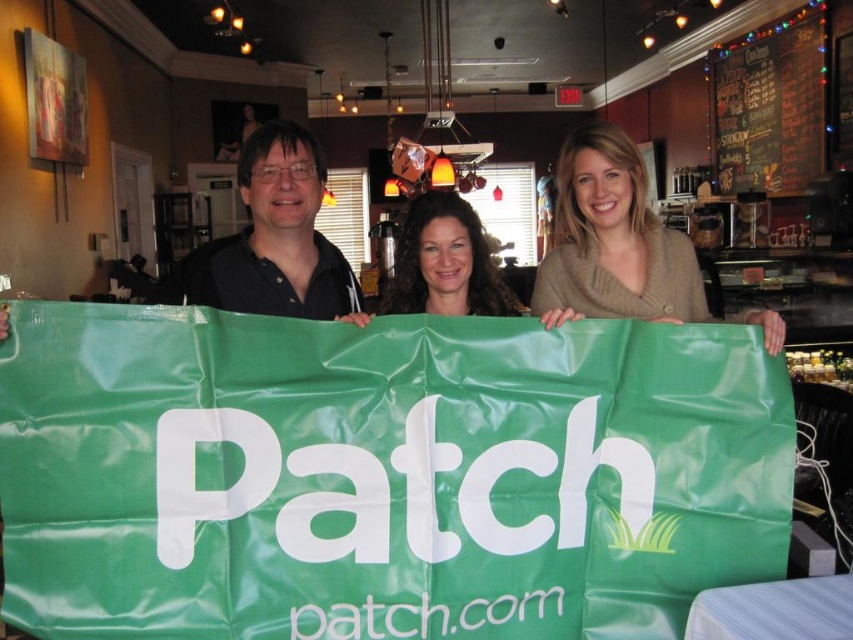
Looking at this image, you are a photographer setting up a shot of the scene. You need to ensure that the matte black shirt at center and the black chalkboard menu at upper right are both in focus. Which object should you adjust the camera focus for first if you want to prioritize the closer one?

The matte black shirt at center is closer than the black chalkboard menu at upper right, so you should adjust the focus for the matte black shirt at center first.